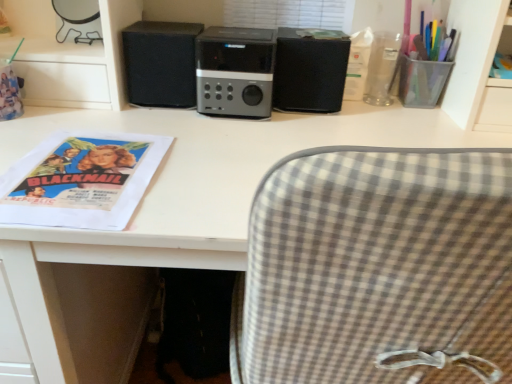
Question: Which direction should I rotate to look at black matte speaker at center, the 1th speaker when ordered from left to right?

Choices:
 (A) left
 (B) right

Answer: (A)

Question: Is transparent plastic cup at upper right, the 2th stationery when ordered from left to right, oriented towards clear plastic cup at upper right, acting as the first stationery starting from the left?

Choices:
 (A) no
 (B) yes

Answer: (A)

Question: Is the surface of transparent plastic cup at upper right, the 2th stationery when ordered from left to right, in direct contact with clear plastic cup at upper right, the second stationery viewed from the right?

Choices:
 (A) no
 (B) yes

Answer: (B)

Question: Considering the relative sizes of transparent plastic cup at upper right, which is the 1th stationery from right to left, and clear plastic cup at upper right, the second stationery viewed from the right, in the image provided, is transparent plastic cup at upper right, which is the 1th stationery from right to left, smaller than clear plastic cup at upper right, the second stationery viewed from the right,?

Choices:
 (A) no
 (B) yes

Answer: (A)

Question: Is transparent plastic cup at upper right, the 2th stationery when ordered from left to right, closer to the viewer compared to clear plastic cup at upper right, acting as the first stationery starting from the left?

Choices:
 (A) yes
 (B) no

Answer: (A)

Question: Is transparent plastic cup at upper right, the 2th stationery when ordered from left to right, at the left side of clear plastic cup at upper right, the second stationery viewed from the right?

Choices:
 (A) yes
 (B) no

Answer: (B)

Question: From the image's perspective, does transparent plastic cup at upper right, which is the 1th stationery from right to left, appear higher than clear plastic cup at upper right, acting as the first stationery starting from the left?

Choices:
 (A) yes
 (B) no

Answer: (A)

Question: Is matte paper poster at left completely or partially outside of clear plastic cup at upper right, acting as the first stationery starting from the left?

Choices:
 (A) yes
 (B) no

Answer: (A)

Question: Is matte paper poster at left oriented away from clear plastic cup at upper right, the second stationery viewed from the right?

Choices:
 (A) no
 (B) yes

Answer: (A)

Question: From the image's perspective, is matte paper poster at left below clear plastic cup at upper right, acting as the first stationery starting from the left?

Choices:
 (A) yes
 (B) no

Answer: (A)

Question: Is clear plastic cup at upper right, the second stationery viewed from the right, inside matte paper poster at left?

Choices:
 (A) yes
 (B) no

Answer: (B)

Question: Does matte paper poster at left have a larger size compared to clear plastic cup at upper right, acting as the first stationery starting from the left?

Choices:
 (A) no
 (B) yes

Answer: (B)

Question: Is matte paper poster at left taller than clear plastic cup at upper right, the second stationery viewed from the right?

Choices:
 (A) no
 (B) yes

Answer: (A)

Question: Could you tell me if satin black speaker at center is turned towards matte paper poster at left?

Choices:
 (A) no
 (B) yes

Answer: (A)